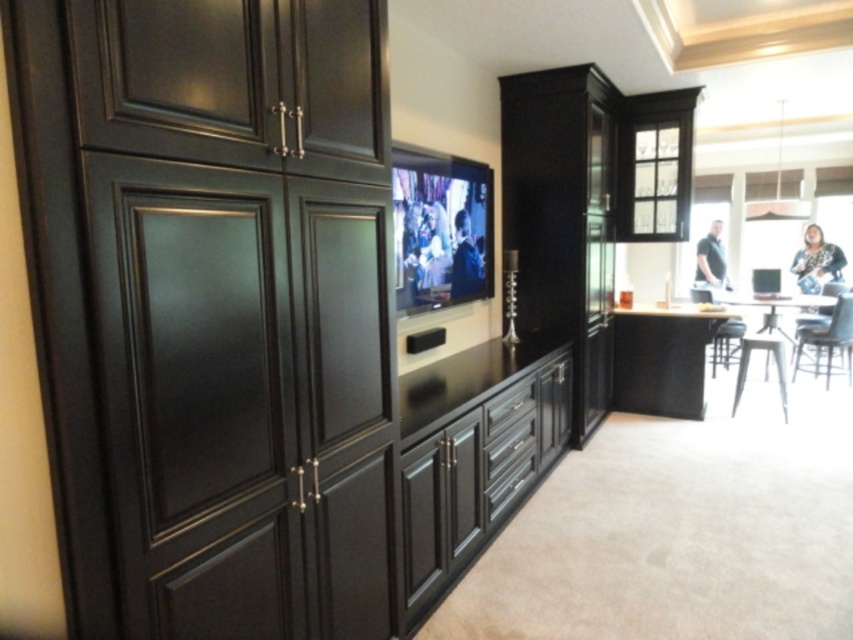
You are setting up a new entertainment system and need to place a large speaker. The speaker requires a stable surface directly below the flat screen tv at center. Is the matte black cabinets at center a suitable location for placing the speaker?

The matte black cabinets at center is positioned under the flat screen tv at center, so yes, the speaker can be placed there as it provides a stable surface directly below the TV.

You are setting up a new speaker system and need to place it on the surface below the flat screen tv at center. Is there enough space on the matte black drawer at center to place it?

The flat screen tv at center is above the matte black drawer at center, so the drawer is directly below the TV. Since the drawer is at center, there should be sufficient space on the matte black drawer at center to place the speaker system.

You are an interior designer planning to place a new piece of furniture between the matte black cabinets at center and the matte black drawer at center. Based on their widths, which object should you consider placing closer to the narrower one to ensure proper spacing?

The matte black drawer at center is narrower than the matte black cabinets at center, so you should place the new furniture closer to the matte black drawer at center to maintain proper spacing between the two objects.